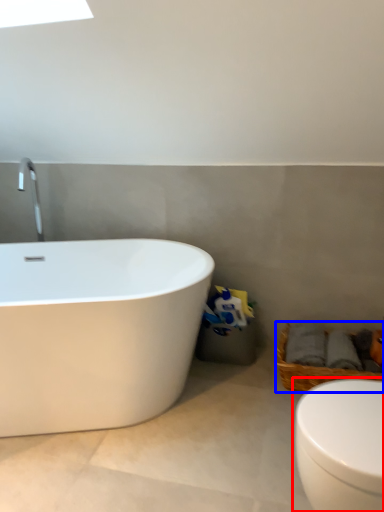
Question: Which of the following is the closest to the observer, toilet (highlighted by a red box) or basket (highlighted by a blue box)?

Choices:
 (A) toilet
 (B) basket

Answer: (A)